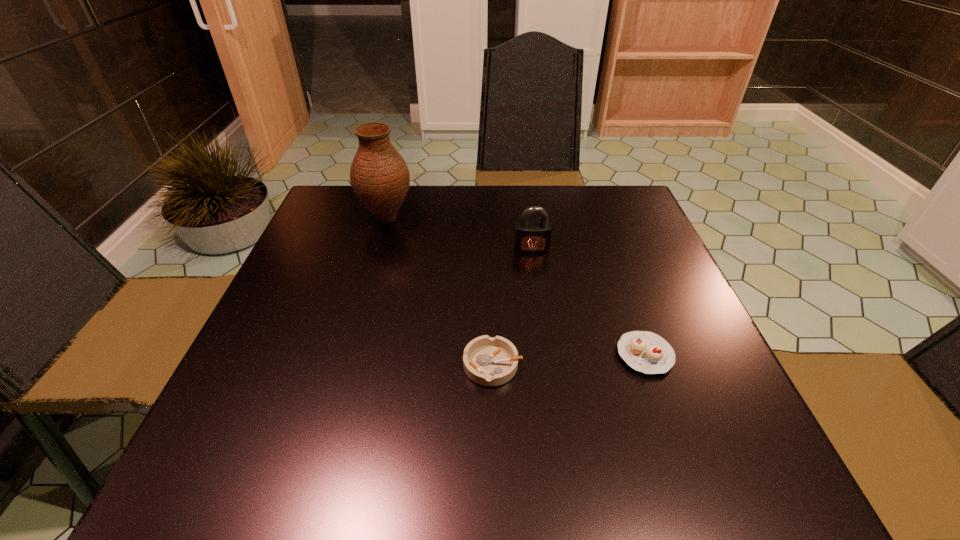
This screenshot has width=960, height=540. I want to click on unoccupied position between the padlock and the rightmost object, so click(588, 301).

The image size is (960, 540). I want to click on object that stands as the second closest to the second farthest object, so click(x=644, y=351).

Locate which object is the third closest to the vase. Please provide its 2D coordinates. Your answer should be formatted as a tuple, i.e. [(x, y)], where the tuple contains the x and y coordinates of a point satisfying the conditions above.

[(644, 351)]

The height and width of the screenshot is (540, 960). Find the location of `vacant space that satisfies the following two spatial constraints: 1. on the front side of the shortest object; 2. on the left side of the leftmost object`. vacant space that satisfies the following two spatial constraints: 1. on the front side of the shortest object; 2. on the left side of the leftmost object is located at coordinates (345, 364).

Where is `vacant space that satisfies the following two spatial constraints: 1. on the front of the cupcake near the keyhole; 2. on the left side of the second farthest object`? The height and width of the screenshot is (540, 960). vacant space that satisfies the following two spatial constraints: 1. on the front of the cupcake near the keyhole; 2. on the left side of the second farthest object is located at coordinates (547, 355).

You are a GUI agent. You are given a task and a screenshot of the screen. Output one action in this format:
    pyautogui.click(x=<x>, y=<y>)
    Task: Click on the free space in the image that satisfies the following two spatial constraints: 1. on the back side of the rightmost object; 2. on the right side of the ashtray
    This screenshot has width=960, height=540.
    Given the screenshot: What is the action you would take?
    point(492,355)

The width and height of the screenshot is (960, 540). What are the coordinates of `free region that satisfies the following two spatial constraints: 1. on the front of the third shortest object near the keyhole; 2. on the left side of the second shortest object` in the screenshot? It's located at (547, 355).

The image size is (960, 540). Find the location of `blank area in the image that satisfies the following two spatial constraints: 1. on the front side of the ashtray; 2. on the right side of the tallest object`. blank area in the image that satisfies the following two spatial constraints: 1. on the front side of the ashtray; 2. on the right side of the tallest object is located at coordinates (345, 364).